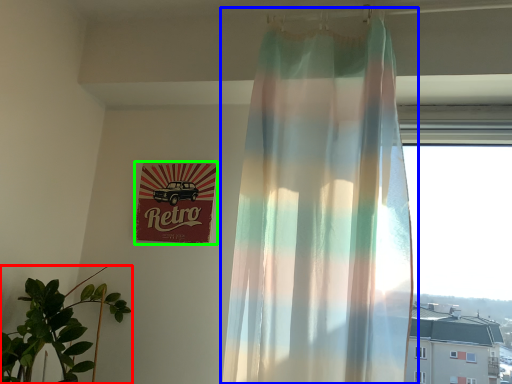
Question: Which object is positioned farthest from houseplant (highlighted by a red box)? Select from curtain (highlighted by a blue box) and signage (highlighted by a green box).

Choices:
 (A) curtain
 (B) signage

Answer: (A)